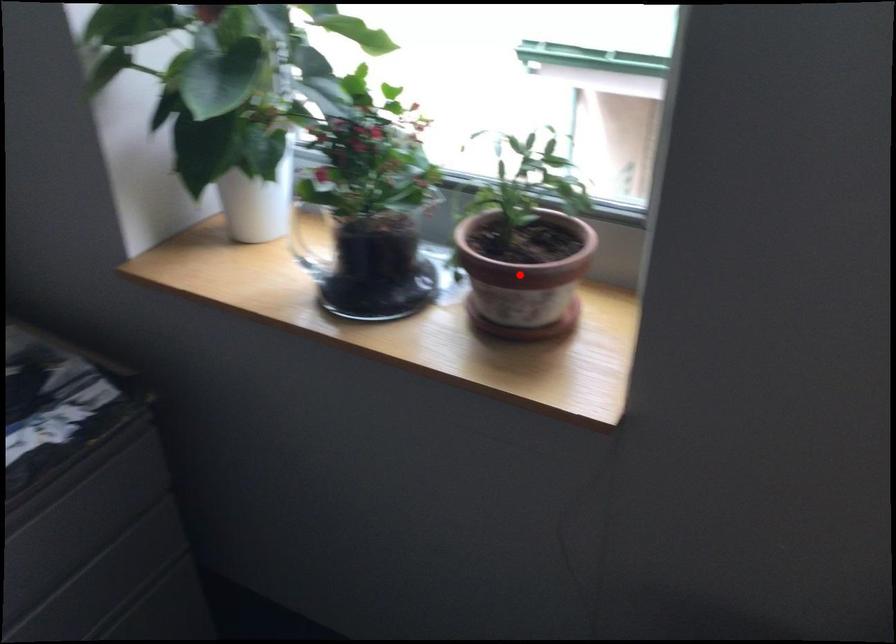
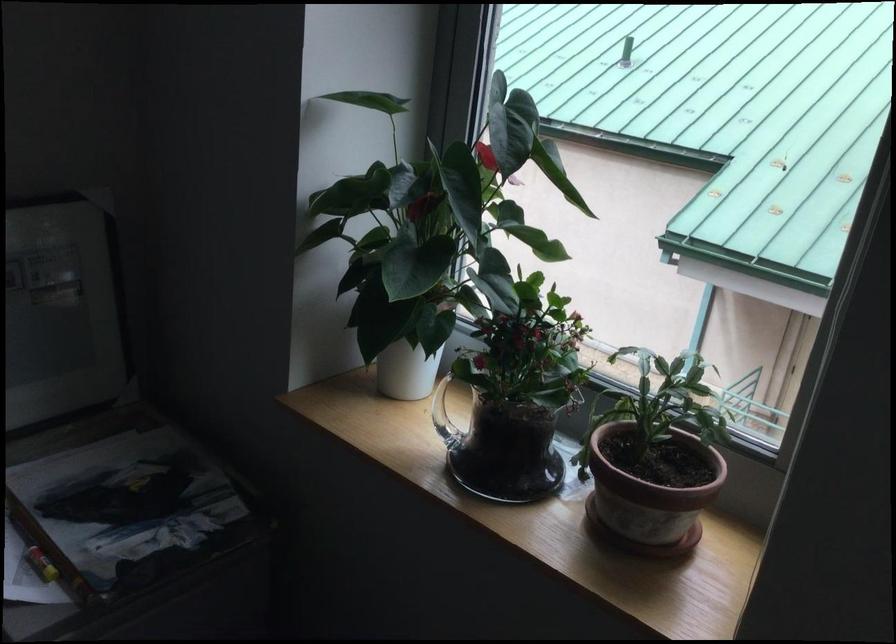
The point at the highlighted location is marked in the first image. Where is the corresponding point in the second image?

(650, 493)